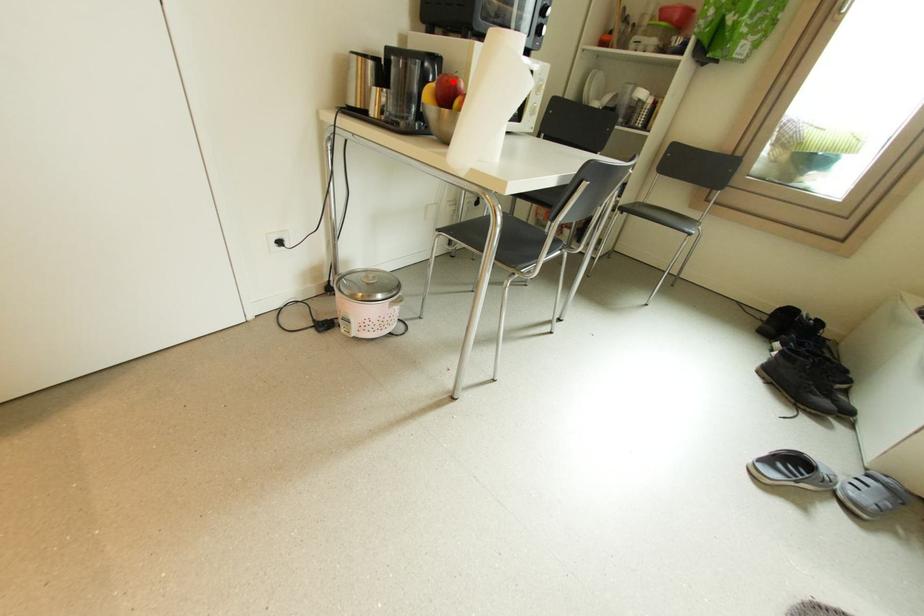
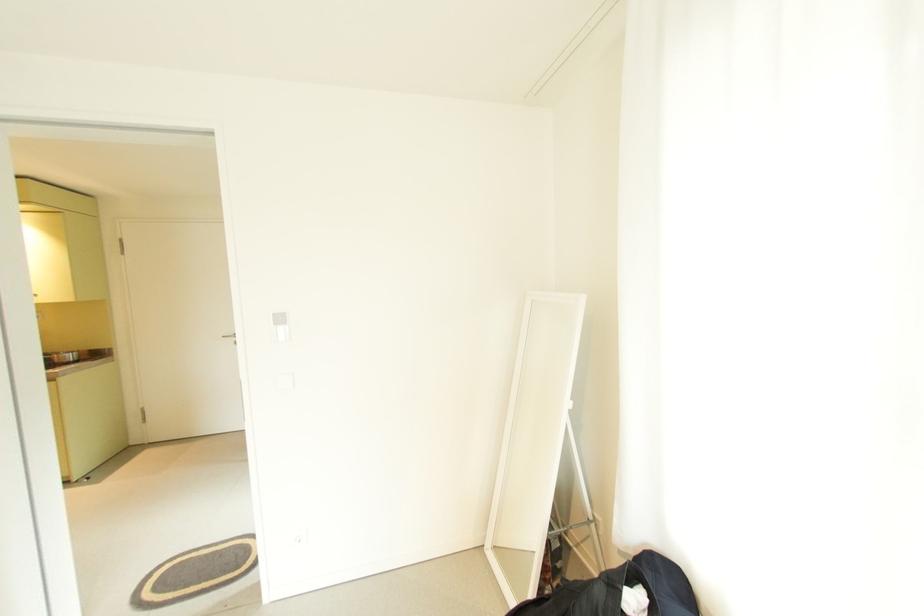
Question: I am providing you with two images of the same scene from different viewpoints. A red point is marked on the first image. At the location where the point appears in image 1, is it still visible in image 2?

Choices:
 (A) Yes
 (B) No

Answer: (B)